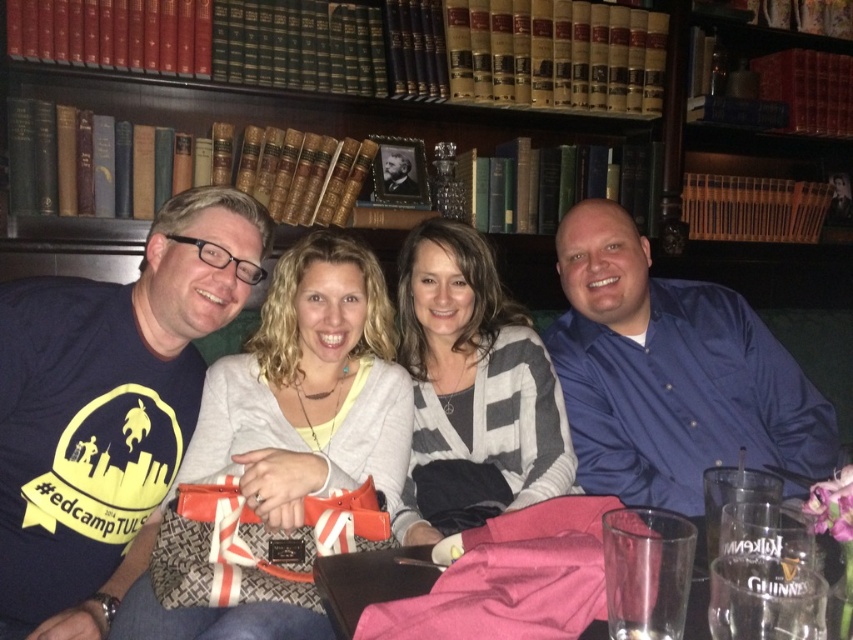
Is matte gray sweater at center thinner than hardcover books at upper center?

Indeed, matte gray sweater at center has a lesser width compared to hardcover books at upper center.

Does point (368, 317) lie in front of point (784, 164)?

Yes, point (368, 317) is closer to viewer.

Find the location of `matte gray sweater at center`. matte gray sweater at center is located at coordinates (309, 388).

Can you confirm if matte gray sweater at center is thinner than pink fabric at lower center?

Correct, matte gray sweater at center's width is less than pink fabric at lower center's.

Measure the distance between matte gray sweater at center and pink fabric at lower center.

14.84 inches

Does point (178, 602) lie in front of point (601, 586)?

No, (178, 602) is further to viewer.

Where is `matte gray sweater at center`? This screenshot has width=853, height=640. matte gray sweater at center is located at coordinates (309, 388).

Does matte blue t-shirt at left have a smaller size compared to blue satin shirt at right?

Yes.

Does matte blue t-shirt at left have a larger size compared to blue satin shirt at right?

Incorrect, matte blue t-shirt at left is not larger than blue satin shirt at right.

Is point (167, 342) positioned before point (801, 492)?

No, it is not.

Identify the location of matte blue t-shirt at left. The image size is (853, 640). (108, 408).